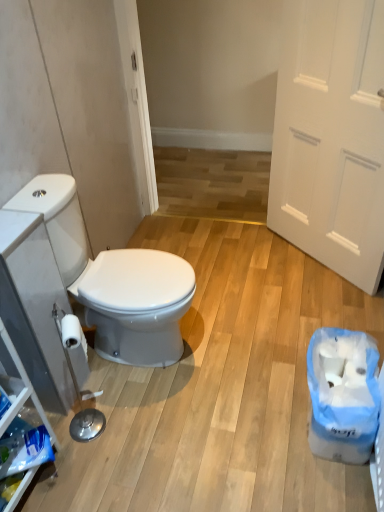
Question: From the image's perspective, is blue plastic bag at lower right positioned above or below white matte door at right?

Choices:
 (A) above
 (B) below

Answer: (B)

Question: Is blue plastic bag at lower right taller or shorter than white matte door at right?

Choices:
 (A) short
 (B) tall

Answer: (A)

Question: Based on their relative distances, which object is farther from the white glossy toilet seat at left?

Choices:
 (A) blue plastic bag at lower right
 (B) white matte door at right

Answer: (B)

Question: Considering the real-world distances, which object is farthest from the blue plastic bag at lower right?

Choices:
 (A) white matte door at right
 (B) white glossy toilet seat at left

Answer: (A)